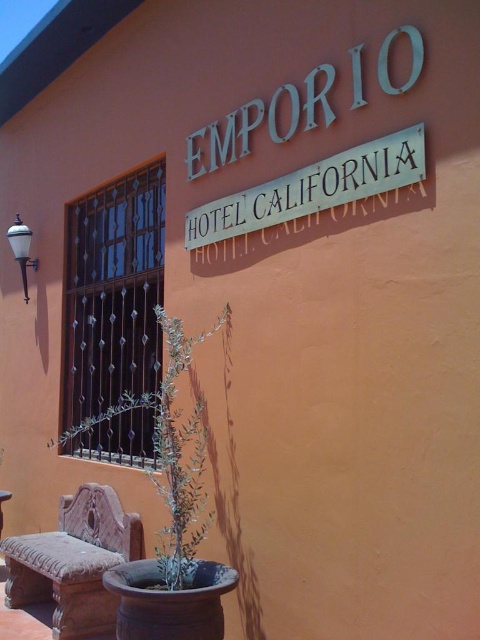
Can you confirm if terracotta carved bench at lower left is wider than metallic silver sign at upper center?

Correct, the width of terracotta carved bench at lower left exceeds that of metallic silver sign at upper center.

Is terracotta carved bench at lower left closer to the viewer compared to metallic silver sign at upper center?

No.

Image resolution: width=480 pixels, height=640 pixels. What are the coordinates of `terracotta carved bench at lower left` in the screenshot? It's located at (73, 561).

Which of these two, terracotta carved bench at lower left or wooden stool at lower left, stands shorter?

wooden stool at lower left

Is point (12, 592) farther from viewer compared to point (0, 524)?

No, it is not.

The width and height of the screenshot is (480, 640). Identify the location of terracotta carved bench at lower left. [73, 561].

Between point (61, 580) and point (152, 396), which one is positioned behind?

The point (152, 396) is more distant.

Between terracotta carved bench at lower left and green leafy plant at center, which one has more height?

green leafy plant at center is taller.

This screenshot has height=640, width=480. I want to click on terracotta carved bench at lower left, so click(73, 561).